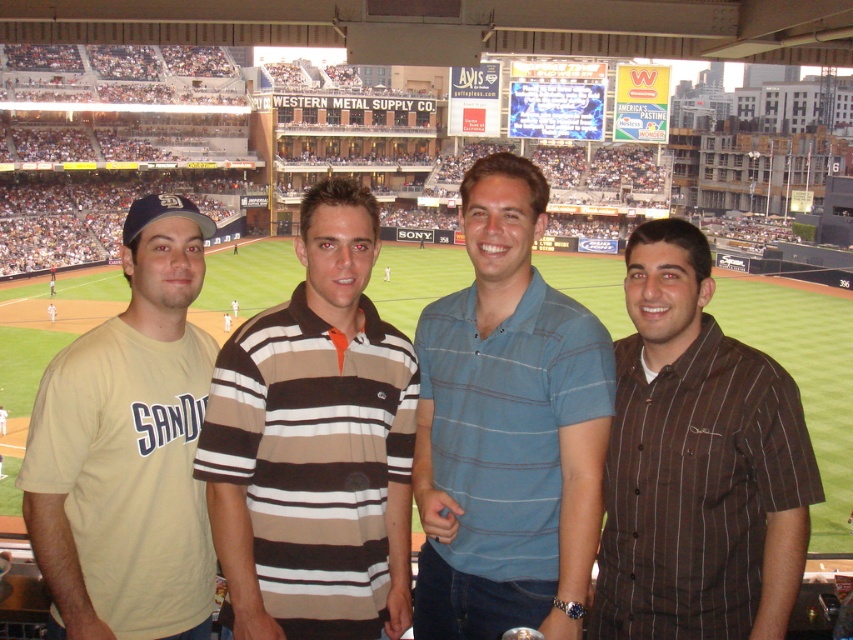
Is point (727, 548) farther from camera compared to point (161, 340)?

No.

Based on the photo, can you confirm if brown striped shirt at right is shorter than matte khaki t-shirt at left?

Yes, brown striped shirt at right is shorter than matte khaki t-shirt at left.

Who is more forward, (660, 560) or (195, 403)?

Point (660, 560) is in front.

The height and width of the screenshot is (640, 853). What are the coordinates of `brown striped shirt at right` in the screenshot? It's located at (697, 464).

Can you confirm if blue striped polo shirt at center is shorter than matte khaki t-shirt at left?

Incorrect, blue striped polo shirt at center's height does not fall short of matte khaki t-shirt at left's.

Between point (486, 401) and point (97, 492), which one is positioned behind?

The point (486, 401) is behind.

Identify the location of blue striped polo shirt at center. This screenshot has width=853, height=640. (508, 428).

At what (x,y) coordinates should I click in order to perform the action: click on blue striped polo shirt at center. Please return your answer as a coordinate pair (x, y). The image size is (853, 640). Looking at the image, I should click on (508, 428).

Consider the image. Can you confirm if brown striped polo shirt at center is shorter than blue striped polo shirt at center?

Indeed, brown striped polo shirt at center has a lesser height compared to blue striped polo shirt at center.

Who is more distant from viewer, (254, 360) or (521, 348)?

Positioned behind is point (521, 348).

At what (x,y) coordinates should I click in order to perform the action: click on brown striped polo shirt at center. Please return your answer as a coordinate pair (x, y). This screenshot has height=640, width=853. Looking at the image, I should click on (314, 444).